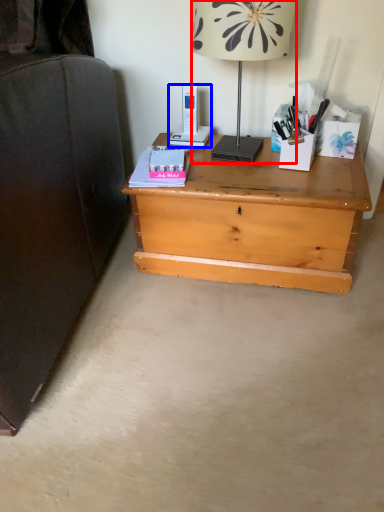
Question: Which of the following is the closest to the observer, lamp (highlighted by a red box) or gadget (highlighted by a blue box)?

Choices:
 (A) lamp
 (B) gadget

Answer: (A)